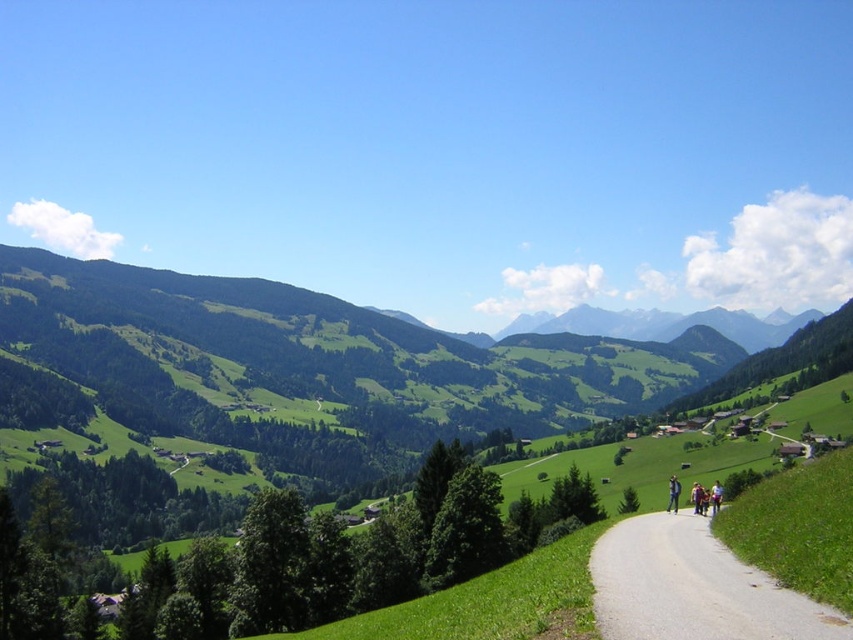
Question: Is gray gravel road at center behind blue fabric jacket at center-right?

Choices:
 (A) yes
 (B) no

Answer: (B)

Question: Which of the following is the farthest from the observer?

Choices:
 (A) (676, 499)
 (B) (697, 637)

Answer: (A)

Question: Is gray gravel road at center wider than blue fabric jacket at center-right?

Choices:
 (A) yes
 (B) no

Answer: (B)

Question: Does gray gravel road at center lie behind blue fabric jacket at center-right?

Choices:
 (A) yes
 (B) no

Answer: (B)